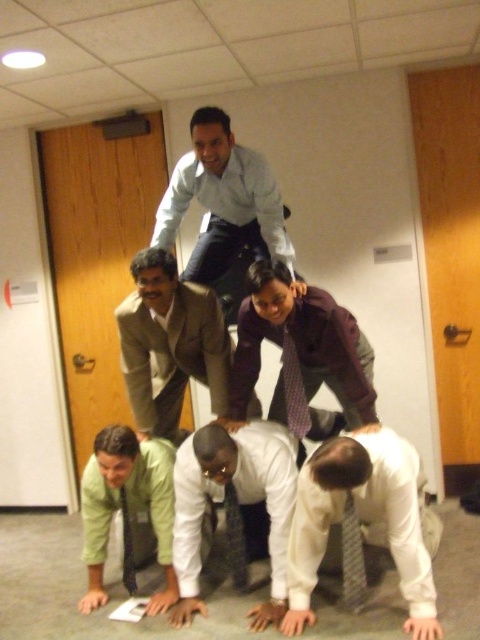
Between white glossy shirt at lower center and striped fabric tie at center, which one has less height?

striped fabric tie at center

Is white glossy shirt at lower center thinner than striped fabric tie at center?

No, white glossy shirt at lower center is not thinner than striped fabric tie at center.

The height and width of the screenshot is (640, 480). Describe the element at coordinates (238, 500) in the screenshot. I see `white glossy shirt at lower center` at that location.

The height and width of the screenshot is (640, 480). I want to click on white glossy shirt at lower center, so click(238, 500).

Is point (379, 452) farther from viewer compared to point (128, 518)?

No, it is not.

Looking at this image, does white matte shirt at lower right have a lesser width compared to dark gray textured tie at lower center?

In fact, white matte shirt at lower right might be wider than dark gray textured tie at lower center.

The image size is (480, 640). Identify the location of white matte shirt at lower right. (361, 520).

Who is higher up, white matte shirt at lower right or maroon textured blazer at center?

Positioned higher is maroon textured blazer at center.

Between point (392, 445) and point (250, 372), which one is positioned behind?

Positioned behind is point (250, 372).

At what (x,y) coordinates should I click in order to perform the action: click on white matte shirt at lower right. Please return your answer as a coordinate pair (x, y). The image size is (480, 640). Looking at the image, I should click on (361, 520).